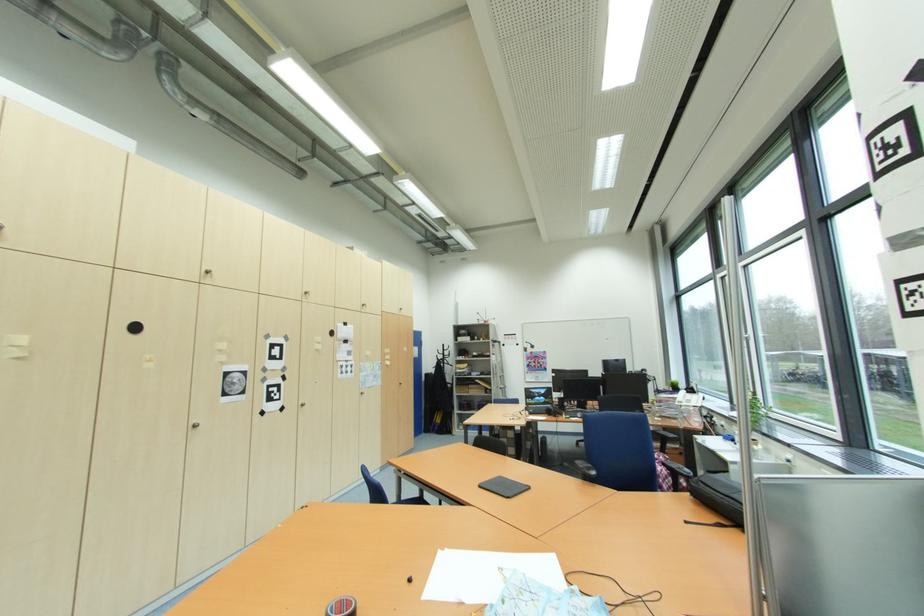
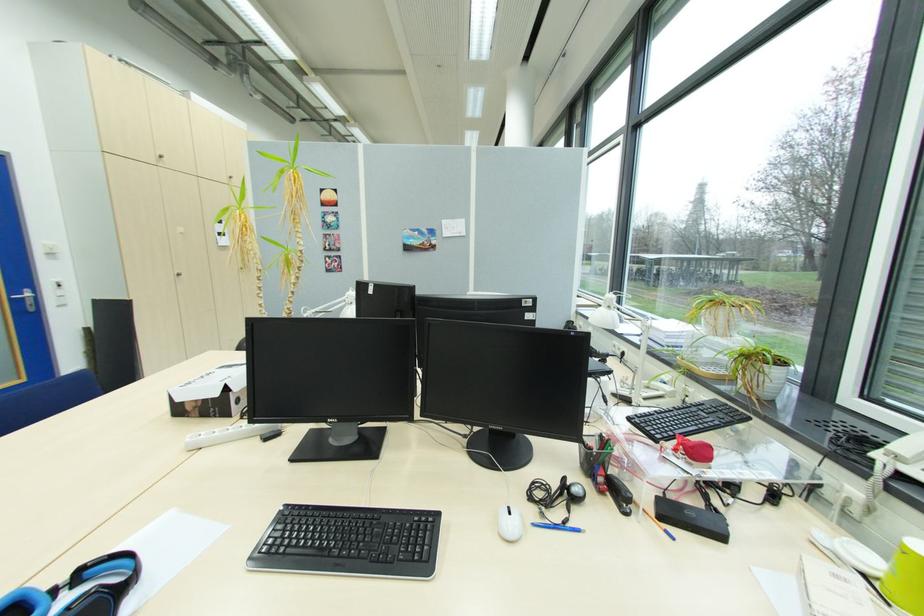
Question: What movement of the cameraman would produce the second image?

Choices:
 (A) Left
 (B) Right
 (C) Forward
 (D) Backward

Answer: (D)